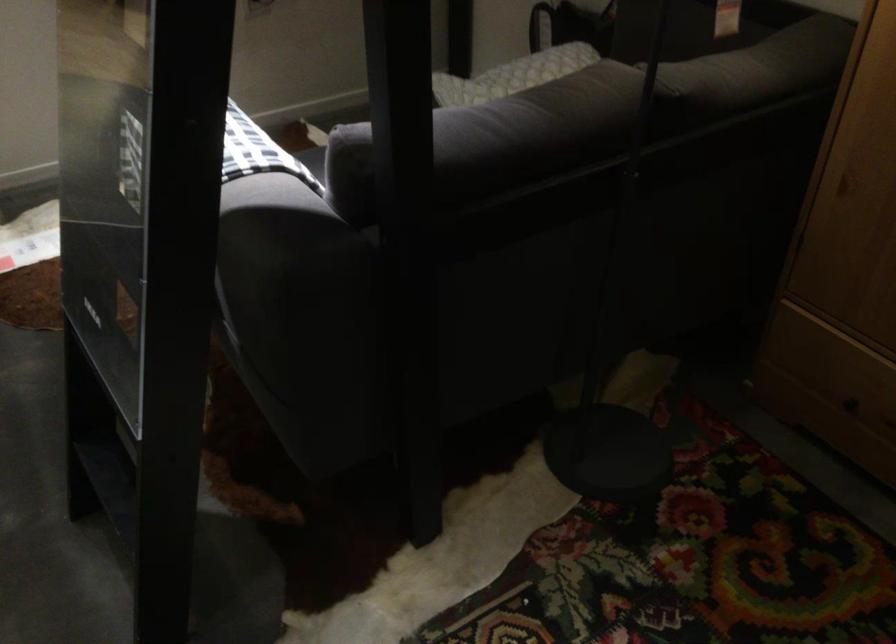
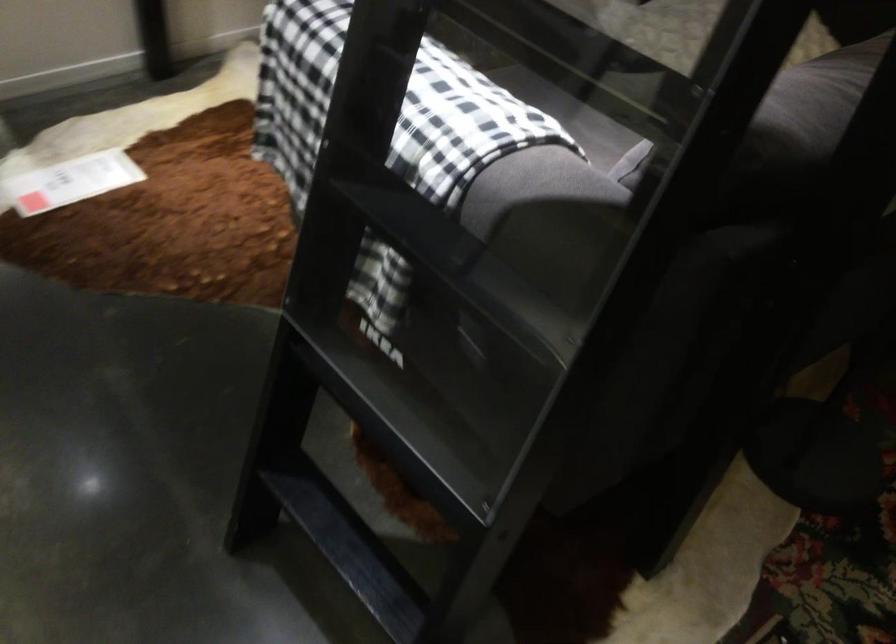
Question: The images are taken continuously from a first-person perspective. In which direction is your viewpoint rotating?

Choices:
 (A) Left
 (B) Right
 (C) Up
 (D) Down

Answer: (D)